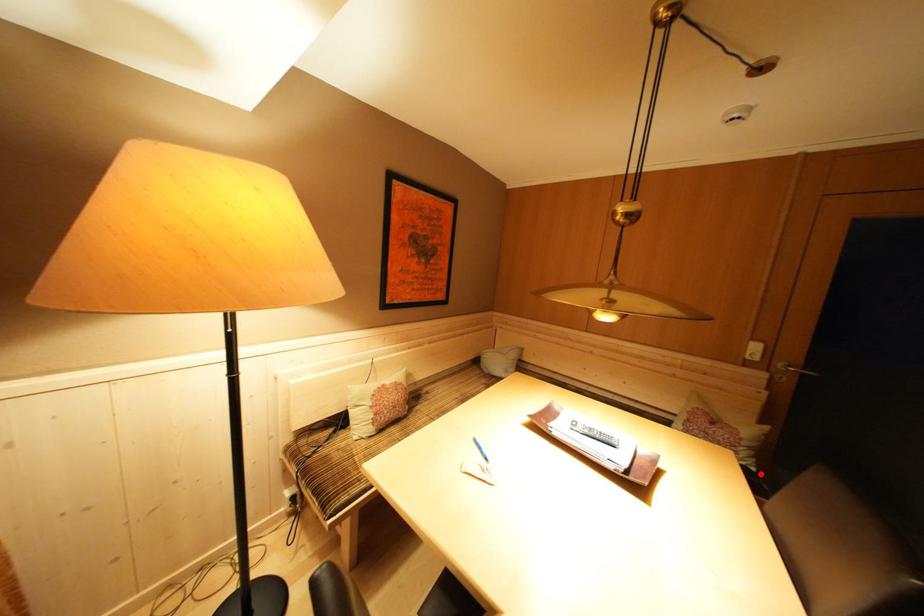
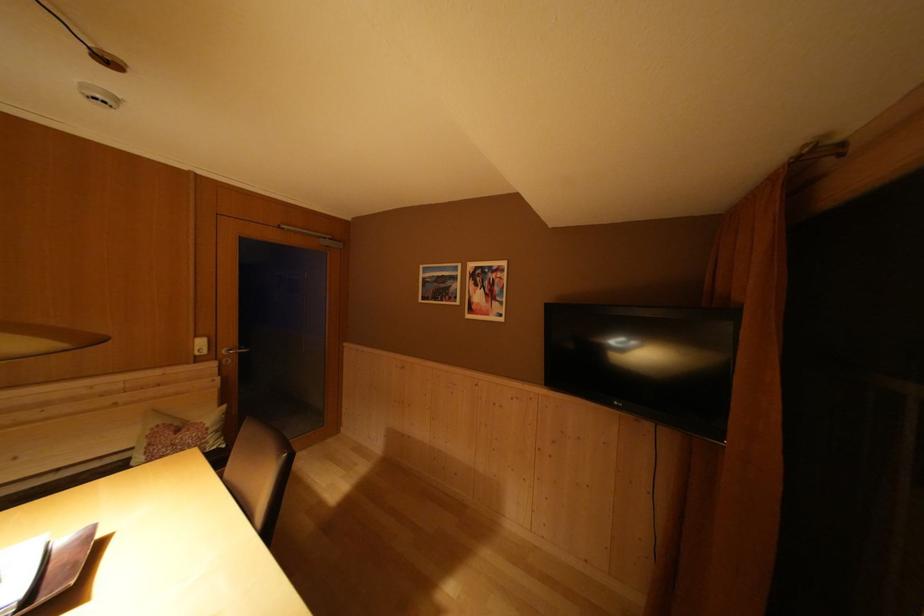
Locate, in the second image, the point that corresponds to the highlighted location in the first image.

(231, 451)